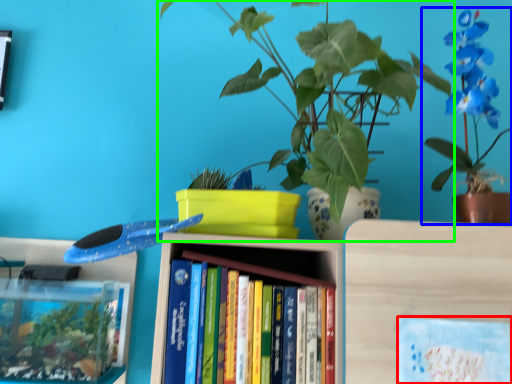
Question: Which object is the farthest from book cover (highlighted by a red box)? Choose among these: houseplant (highlighted by a blue box) or houseplant (highlighted by a green box).

Choices:
 (A) houseplant
 (B) houseplant

Answer: (B)